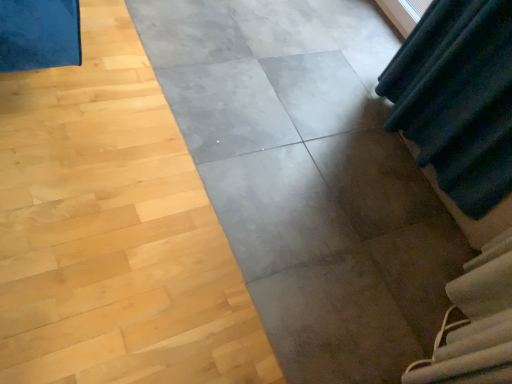
Question: Is gray concrete at center thinner than white fabric at lower right?

Choices:
 (A) no
 (B) yes

Answer: (A)

Question: Can you confirm if gray concrete at center is bigger than white fabric at lower right?

Choices:
 (A) yes
 (B) no

Answer: (A)

Question: From the image's perspective, is gray concrete at center under white fabric at lower right?

Choices:
 (A) yes
 (B) no

Answer: (B)

Question: Can you confirm if gray concrete at center is positioned to the left of white fabric at lower right?

Choices:
 (A) yes
 (B) no

Answer: (A)

Question: Are gray concrete at center and white fabric at lower right making contact?

Choices:
 (A) yes
 (B) no

Answer: (B)

Question: Considering the relative sizes of gray concrete at center and white fabric at lower right in the image provided, is gray concrete at center taller than white fabric at lower right?

Choices:
 (A) no
 (B) yes

Answer: (A)

Question: Is white fabric at lower right wider than gray concrete at center?

Choices:
 (A) yes
 (B) no

Answer: (B)

Question: Is white fabric at lower right closer to the viewer compared to gray concrete at center?

Choices:
 (A) yes
 (B) no

Answer: (B)

Question: Is white fabric at lower right taller than gray concrete at center?

Choices:
 (A) no
 (B) yes

Answer: (B)

Question: Would you say gray concrete at center is part of white fabric at lower right's contents?

Choices:
 (A) no
 (B) yes

Answer: (A)

Question: Is white fabric at lower right next to gray concrete at center and touching it?

Choices:
 (A) no
 (B) yes

Answer: (A)

Question: Is white fabric at lower right at the right side of gray concrete at center?

Choices:
 (A) yes
 (B) no

Answer: (A)

Question: Relative to white fabric at lower right, is gray concrete at center in front or behind?

Choices:
 (A) front
 (B) behind

Answer: (A)